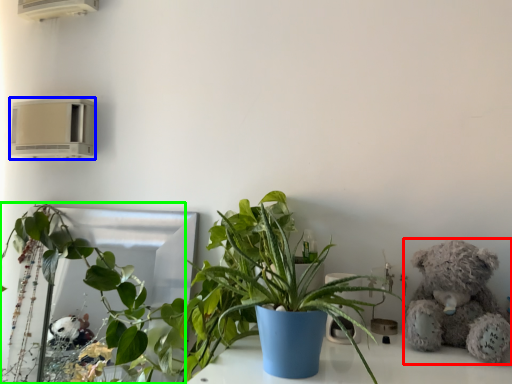
Question: Considering the real-world distances, which object is closest to teddy bear (highlighted by a red box)? air conditioning (highlighted by a blue box) or houseplant (highlighted by a green box).

Choices:
 (A) air conditioning
 (B) houseplant

Answer: (B)